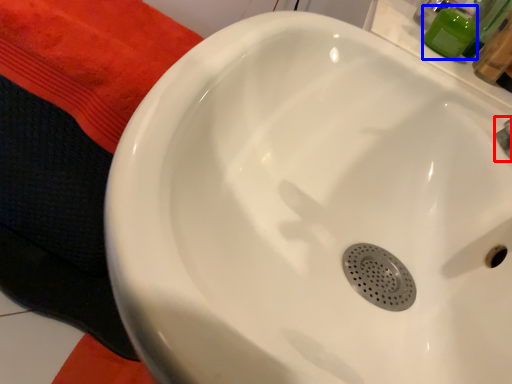
Question: Which of the following is the closest to the observer, plumbing fixture (highlighted by a red box) or toiletry (highlighted by a blue box)?

Choices:
 (A) plumbing fixture
 (B) toiletry

Answer: (A)